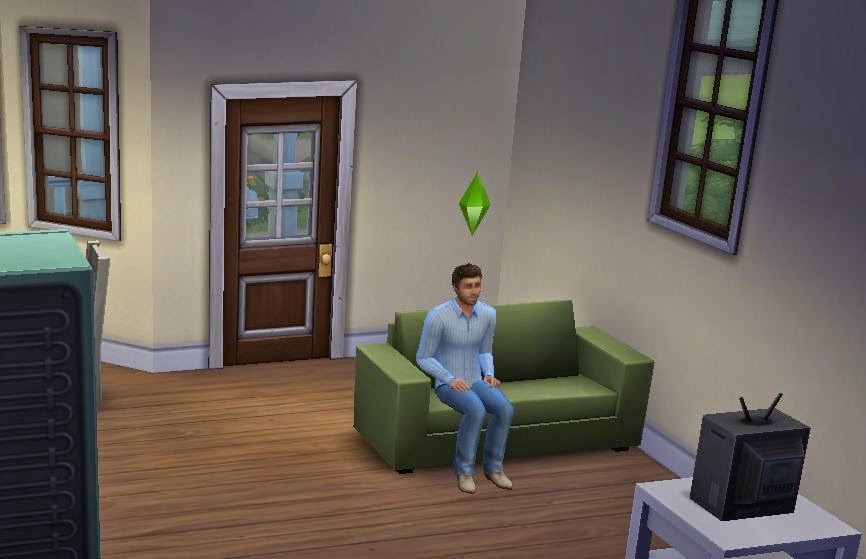
The height and width of the screenshot is (559, 866). Identify the location of window. (53, 124), (276, 186), (708, 126).